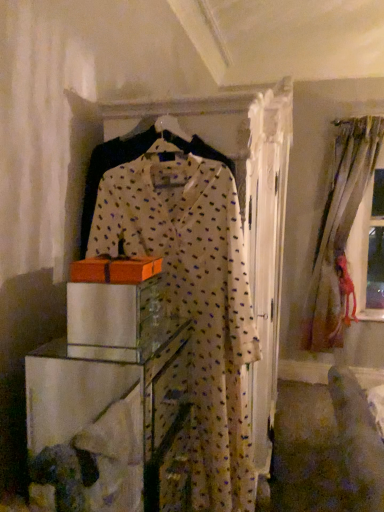
Question: Considering the positions of point (92, 271) and point (312, 280), is point (92, 271) closer or farther from the camera than point (312, 280)?

Choices:
 (A) farther
 (B) closer

Answer: (B)

Question: Is orange cardboard box at center to the left or to the right of silky beige curtains at right in the image?

Choices:
 (A) left
 (B) right

Answer: (A)

Question: Which object is the closest to the white dotted fabric dress at center?

Choices:
 (A) silky beige curtains at right
 (B) orange cardboard box at center
 (C) clear glass cabinet at center

Answer: (B)

Question: Which object is the farthest from the silky beige curtains at right?

Choices:
 (A) orange cardboard box at center
 (B) clear glass cabinet at center
 (C) white dotted fabric dress at center

Answer: (A)